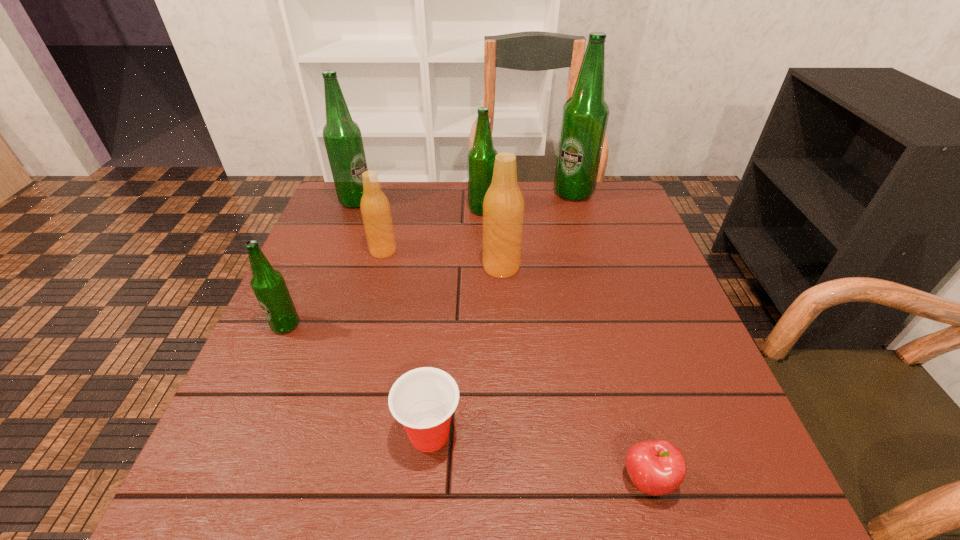
The image size is (960, 540). In order to click on object that is at the near right corner in this screenshot , I will do pos(657,467).

Identify the location of vacant space at the far edge of the desktop. [x=578, y=206].

The height and width of the screenshot is (540, 960). Find the location of `free space at the near edge of the desktop`. free space at the near edge of the desktop is located at coordinates (596, 513).

Locate an element on the screen. The height and width of the screenshot is (540, 960). free space at the left edge of the desktop is located at coordinates (304, 254).

Identify the location of free location at the right edge of the desktop. The image size is (960, 540). (636, 335).

Locate an element on the screen. The width and height of the screenshot is (960, 540). vacant space that is in between the bigger tan beer bottle and the sixth farthest object is located at coordinates (394, 296).

Where is `free area in between the nearest green beer bottle and the rightmost green beer bottle`? free area in between the nearest green beer bottle and the rightmost green beer bottle is located at coordinates (429, 259).

Locate an element on the screen. The image size is (960, 540). vacant area between the shortest object and the sixth farthest object is located at coordinates (467, 403).

Identify the location of vacant space that's between the smallest green beer bottle and the second biggest green beer bottle. (321, 263).

Find the location of a particular element. The image size is (960, 540). empty space that is in between the smallest green beer bottle and the second shortest object is located at coordinates (357, 380).